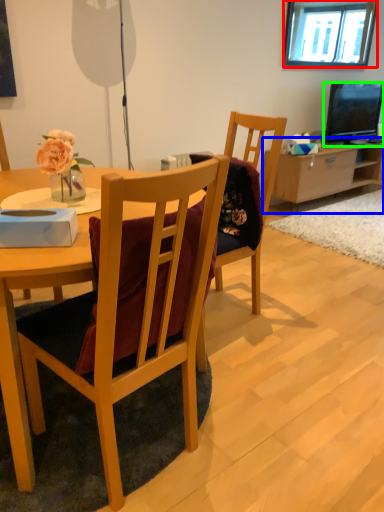
Question: Estimate the real-world distances between objects in this image. Which object is farther from window (highlighted by a red box), cabinetry (highlighted by a blue box) or television (highlighted by a green box)?

Choices:
 (A) cabinetry
 (B) television

Answer: (A)